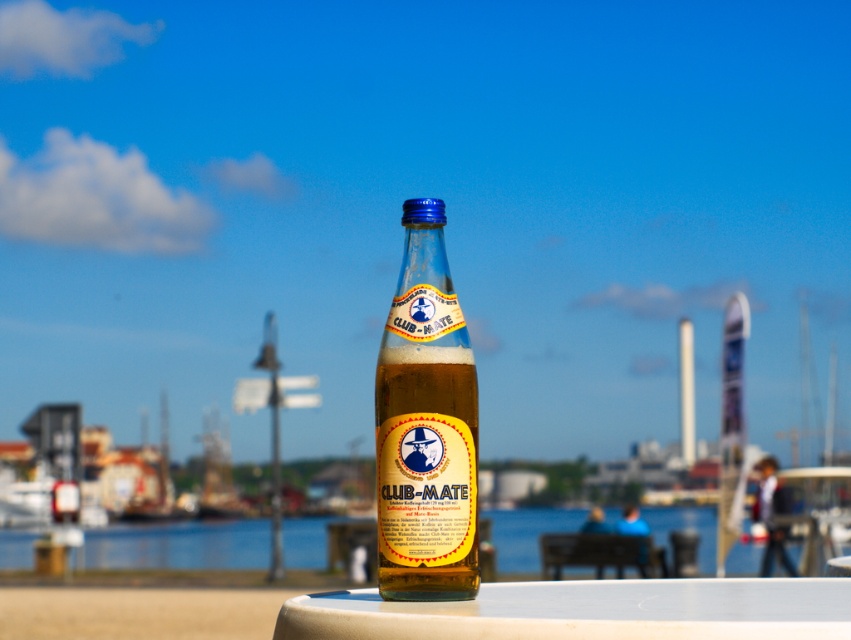
Question: Considering the real-world distances, which object is closest to the translucent glass bottle at center?

Choices:
 (A) transparent glass water at bottle front
 (B) white plastic table at center

Answer: (B)

Question: Is translucent glass bottle at center bigger than transparent glass water at bottle front?

Choices:
 (A) no
 (B) yes

Answer: (A)

Question: Which object is the farthest from the transparent glass water at bottle front?

Choices:
 (A) white plastic table at center
 (B) translucent glass bottle at center

Answer: (B)

Question: Does translucent glass bottle at center lie behind transparent glass water at bottle front?

Choices:
 (A) yes
 (B) no

Answer: (B)

Question: Which point is closer to the camera taking this photo?

Choices:
 (A) (489, 627)
 (B) (406, 356)
 (C) (260, 564)

Answer: (A)

Question: Can you confirm if translucent glass bottle at center is smaller than white plastic table at center?

Choices:
 (A) yes
 (B) no

Answer: (A)